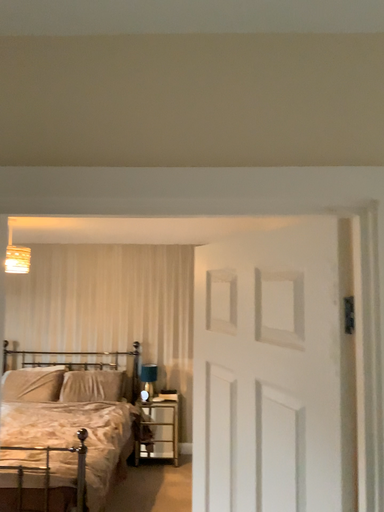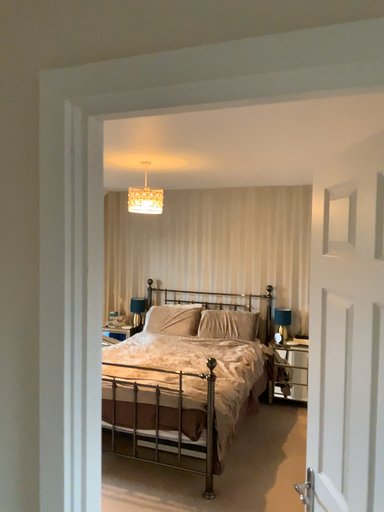
Question: Which way did the camera rotate in the video?

Choices:
 (A) rotated left
 (B) rotated right

Answer: (A)